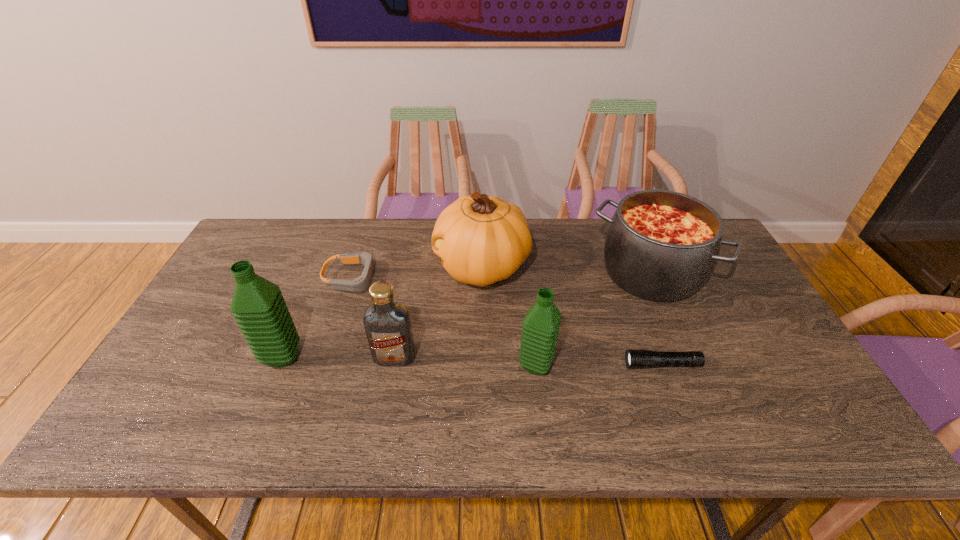
Image resolution: width=960 pixels, height=540 pixels. I want to click on the taller water bottle, so click(259, 309).

You are a GUI agent. You are given a task and a screenshot of the screen. Output one action in this format:
    pyautogui.click(x=<x>, y=<y>)
    Task: Click on the shorter water bottle
    The image size is (960, 540).
    Given the screenshot: What is the action you would take?
    pyautogui.click(x=541, y=325)

The width and height of the screenshot is (960, 540). I want to click on pumpkin, so click(x=481, y=239).

Image resolution: width=960 pixels, height=540 pixels. In order to click on goggles in this screenshot , I will do `click(360, 284)`.

This screenshot has width=960, height=540. Find the location of `casserole`. casserole is located at coordinates (661, 245).

This screenshot has width=960, height=540. What are the coordinates of `the fifth object from right to left` in the screenshot? It's located at 387,324.

Find the location of a particular element. This screenshot has height=540, width=960. flashlight is located at coordinates (633, 358).

Find the location of a particular element. The image size is (960, 540). vacant position located 0.270m on the back of the taller water bottle is located at coordinates (316, 274).

Where is `free point located on the left of the right water bottle`? This screenshot has height=540, width=960. free point located on the left of the right water bottle is located at coordinates (377, 365).

The width and height of the screenshot is (960, 540). What are the coordinates of `vacant area located 0.180m on the front face of the pumpkin` in the screenshot? It's located at (376, 267).